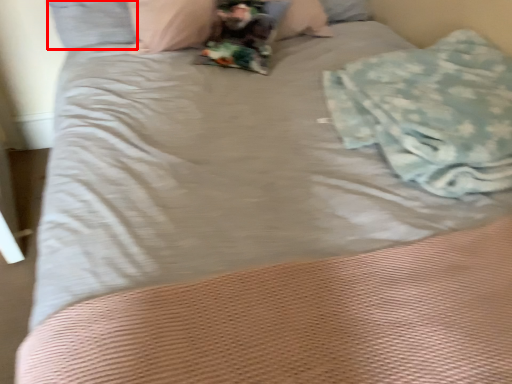
Question: From the image's perspective, considering the relative positions of pillow (annotated by the red box) and material in the image provided, where is pillow (annotated by the red box) located with respect to the staircase?

Choices:
 (A) below
 (B) above

Answer: (B)